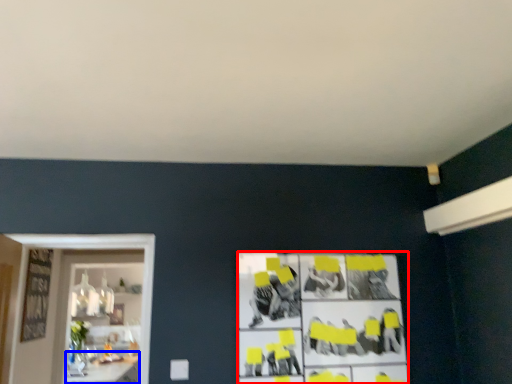
Question: Among these objects, which one is nearest to the camera, poster (highlighted by a red box) or table (highlighted by a blue box)?

Choices:
 (A) poster
 (B) table

Answer: (A)